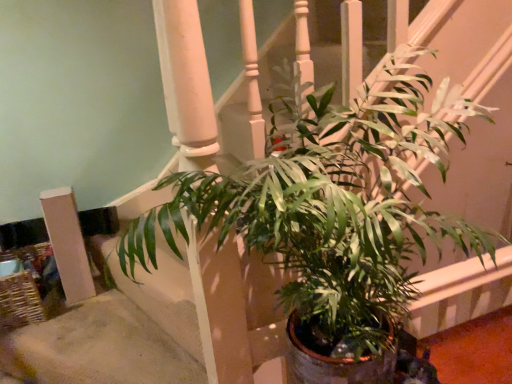
Question: Is white matte pillar at lower left taller or shorter than green glossy leafy plant at center?

Choices:
 (A) tall
 (B) short

Answer: (B)

Question: From a real-world perspective, is white matte pillar at lower left above or below green glossy leafy plant at center?

Choices:
 (A) below
 (B) above

Answer: (A)

Question: Looking at the image, does white matte pillar at lower left seem bigger or smaller compared to green glossy leafy plant at center?

Choices:
 (A) big
 (B) small

Answer: (B)

Question: From a real-world perspective, relative to white matte pillar at lower left, is green glossy leafy plant at center vertically above or below?

Choices:
 (A) below
 (B) above

Answer: (B)

Question: Does point (411, 82) appear closer or farther from the camera than point (75, 248)?

Choices:
 (A) farther
 (B) closer

Answer: (B)

Question: Considering their positions, is green glossy leafy plant at center located in front of or behind white matte pillar at lower left?

Choices:
 (A) behind
 (B) front

Answer: (B)

Question: From the image's perspective, is green glossy leafy plant at center positioned above or below white matte pillar at lower left?

Choices:
 (A) above
 (B) below

Answer: (A)